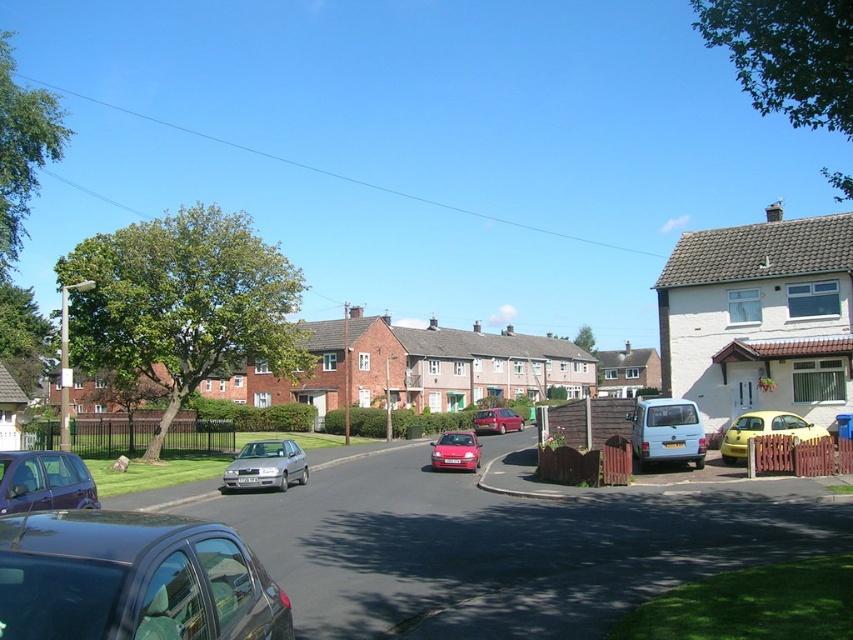
Based on the photo, you are a delivery person standing at the entrance of the suburban street scene. You need to deliver a package to the house closest to the silver metallic hatchback at lower left. Which house should you go to?

The house closest to the silver metallic hatchback at lower left would be the one nearest to it, but the exact house isn

You are a delivery driver who needs to park your vehicle between the silver metallic hatchback at lower left and the yellow matte car at right. Is there enough space for your 5.5 feet wide delivery van?

The silver metallic hatchback at lower left is positioned on the left side of yellow matte car at right. Since the distance between them is not specified, but the van is 5.5 feet wide, it is uncertain if there is enough space. Please check the actual distance between the two cars before deciding.

You are a delivery person needing to park your 5.5 meter long truck between the silver metallic hatchback at lower left and the metallic red car at center. Can you fit your truck there?

The distance between the silver metallic hatchback at lower left and metallic red car at center is 30.22 meters, which is more than enough to accommodate a 5.5 meter long truck.